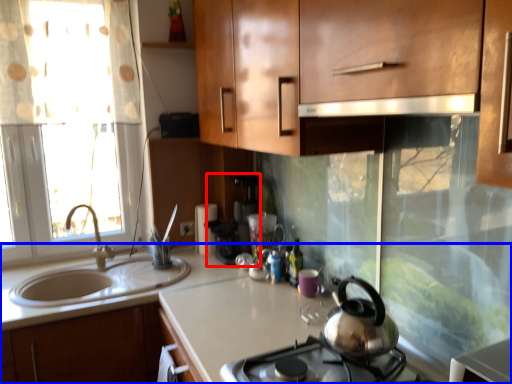
Question: Among these objects, which one is nearest to the camera, coffee machine (highlighted by a red box) or countertop (highlighted by a blue box)?

Choices:
 (A) coffee machine
 (B) countertop

Answer: (B)